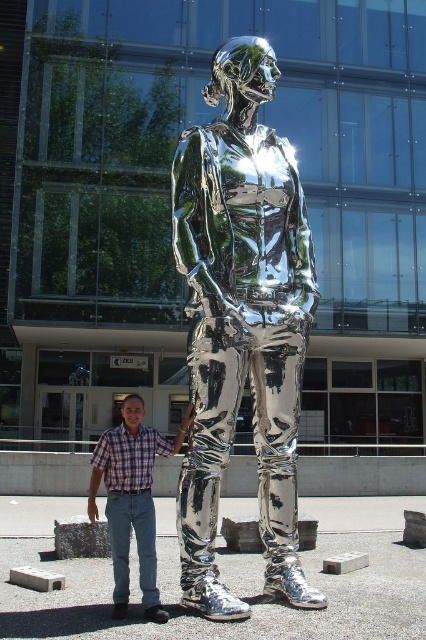
The height and width of the screenshot is (640, 426). In order to click on shiny metallic figure at center in this screenshot , I will do `click(241, 323)`.

Which is above, shiny metallic figure at center or plaid shirt at center?

shiny metallic figure at center

Where is `shiny metallic figure at center`? The height and width of the screenshot is (640, 426). shiny metallic figure at center is located at coordinates (241, 323).